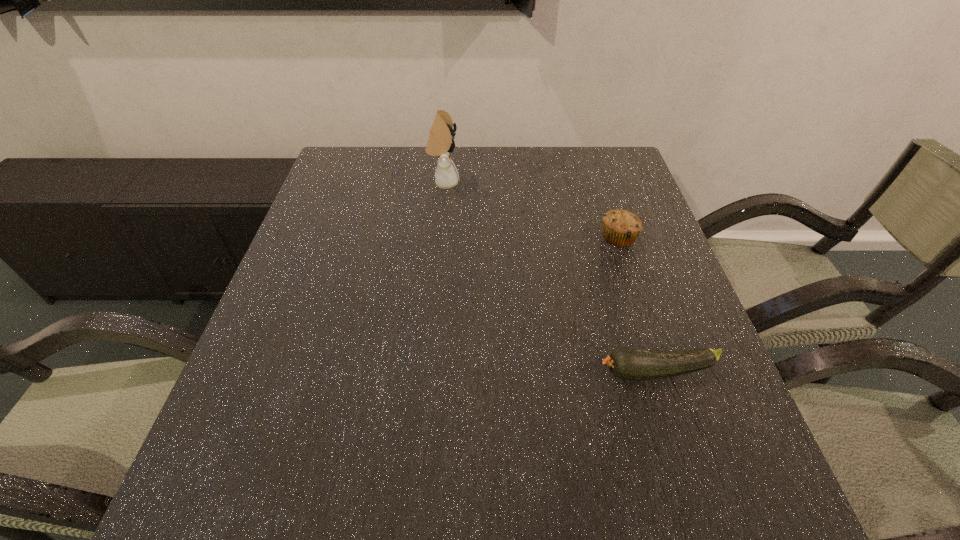
This screenshot has height=540, width=960. I want to click on vacant space that's between the second nearest object and the nearest object, so click(637, 305).

I want to click on vacant area that lies between the farthest object and the second nearest object, so click(531, 210).

This screenshot has height=540, width=960. I want to click on free spot between the muffin and the zucchini, so click(x=637, y=305).

Locate an element on the screen. The image size is (960, 540). vacant area between the shortest object and the muffin is located at coordinates (637, 305).

Locate an element on the screen. free point between the muffin and the farthest object is located at coordinates (531, 210).

At what (x,y) coordinates should I click in order to perform the action: click on free spot between the second farthest object and the zucchini. Please return your answer as a coordinate pair (x, y). Looking at the image, I should click on (637, 305).

Where is `vacant area that lies between the shortest object and the doll`? vacant area that lies between the shortest object and the doll is located at coordinates (550, 277).

Find the location of `vacant area that lies between the zucchini and the second shortest object`. vacant area that lies between the zucchini and the second shortest object is located at coordinates (637, 305).

At what (x,y) coordinates should I click in order to perform the action: click on free space that is in between the shortest object and the muffin. Please return your answer as a coordinate pair (x, y). The height and width of the screenshot is (540, 960). Looking at the image, I should click on click(x=637, y=305).

Locate an element on the screen. The image size is (960, 540). object that is the closest to the second tallest object is located at coordinates (626, 363).